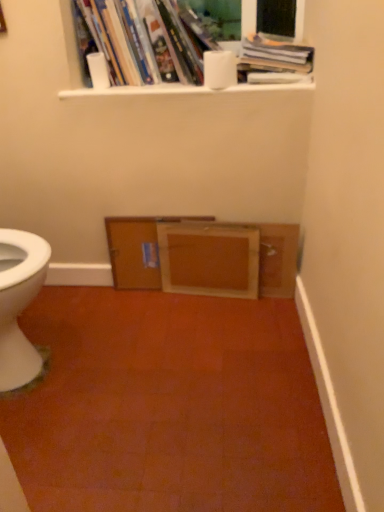
Question: Is white matte toilet paper at upper center, the first toilet paper when ordered from left to right, shorter than hardcover books at upper center, which is counted as the first book, starting from the left?

Choices:
 (A) yes
 (B) no

Answer: (A)

Question: Is white matte toilet paper at upper center, the first toilet paper when ordered from left to right, bigger than hardcover books at upper center, the 2th book when ordered from right to left?

Choices:
 (A) no
 (B) yes

Answer: (A)

Question: Is white matte toilet paper at upper center, the first toilet paper when ordered from left to right, facing towards hardcover books at upper center, the 2th book when ordered from right to left?

Choices:
 (A) yes
 (B) no

Answer: (A)

Question: Does white matte toilet paper at upper center, the second toilet paper when ordered from right to left, have a greater width compared to hardcover books at upper center, which is counted as the first book, starting from the left?

Choices:
 (A) yes
 (B) no

Answer: (B)

Question: Would you consider white matte toilet paper at upper center, the second toilet paper when ordered from right to left, to be distant from hardcover books at upper center, which is counted as the first book, starting from the left?

Choices:
 (A) yes
 (B) no

Answer: (B)

Question: Is white matte toilet paper at upper center, the second toilet paper when ordered from right to left, closer to camera compared to hardcover books at upper center, the 2th book when ordered from right to left?

Choices:
 (A) no
 (B) yes

Answer: (A)

Question: Is white matte toilet paper at upper center, arranged as the second toilet paper when viewed from the left, outside wooden frame at center, acting as the 2th file cabinet starting from the left?

Choices:
 (A) no
 (B) yes

Answer: (B)

Question: Does white matte toilet paper at upper center, arranged as the second toilet paper when viewed from the left, turn towards wooden frame at center, acting as the 2th file cabinet starting from the left?

Choices:
 (A) yes
 (B) no

Answer: (B)

Question: Does white matte toilet paper at upper center, which is counted as the first toilet paper, starting from the right, have a greater width compared to wooden frame at center, which is counted as the first file cabinet, starting from the right?

Choices:
 (A) no
 (B) yes

Answer: (B)

Question: From the image's perspective, is white matte toilet paper at upper center, arranged as the second toilet paper when viewed from the left, over wooden frame at center, which is counted as the first file cabinet, starting from the right?

Choices:
 (A) yes
 (B) no

Answer: (A)

Question: Is white matte toilet paper at upper center, arranged as the second toilet paper when viewed from the left, to the left of wooden frame at center, acting as the 2th file cabinet starting from the left, from the viewer's perspective?

Choices:
 (A) no
 (B) yes

Answer: (A)

Question: Is white matte toilet paper at upper center, arranged as the second toilet paper when viewed from the left, further to the viewer compared to wooden frame at center, which is counted as the first file cabinet, starting from the right?

Choices:
 (A) yes
 (B) no

Answer: (B)

Question: Can you confirm if white matte toilet paper at upper center, which is counted as the first toilet paper, starting from the right, is bigger than hardcover books at upper center, which is counted as the first book, starting from the left?

Choices:
 (A) no
 (B) yes

Answer: (A)